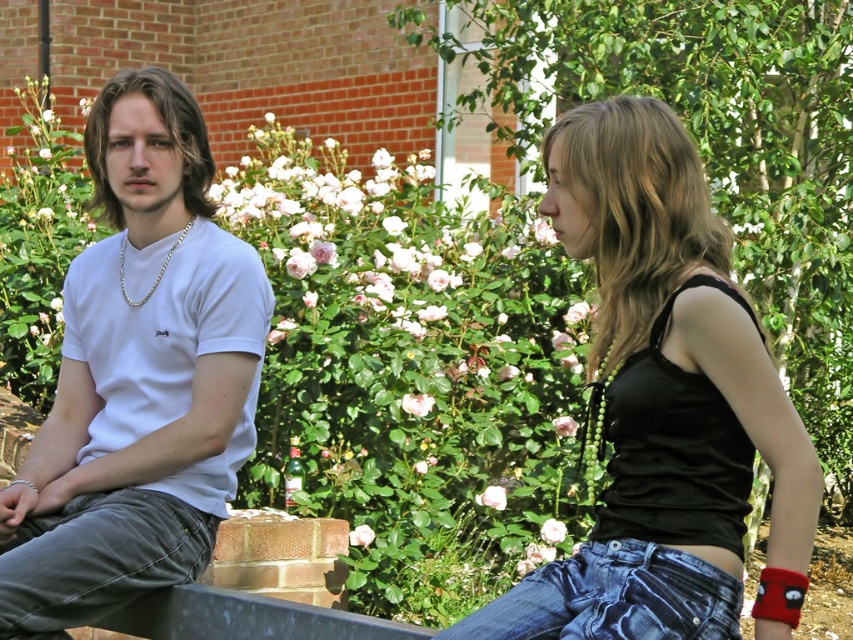
Question: Which point is closer to the camera taking this photo?

Choices:
 (A) (160, 115)
 (B) (445, 637)
 (C) (50, 636)
 (D) (662, 608)

Answer: (D)

Question: Considering the relative positions of denim at left and blue denim jeans at lower right in the image provided, where is denim at left located with respect to blue denim jeans at lower right?

Choices:
 (A) left
 (B) right

Answer: (A)

Question: Does denim at left appear under blue denim jeans at lower right?

Choices:
 (A) yes
 (B) no

Answer: (A)

Question: Is black satin tank top at right below denim at left?

Choices:
 (A) yes
 (B) no

Answer: (B)

Question: Which is nearer to the black satin tank top at right?

Choices:
 (A) blue denim jeans at lower right
 (B) white matte t-shirt at left
 (C) denim at left

Answer: (A)

Question: Among these points, which one is nearest to the camera?

Choices:
 (A) (648, 456)
 (B) (107, 518)
 (C) (45, 611)
 (D) (682, 593)

Answer: (D)